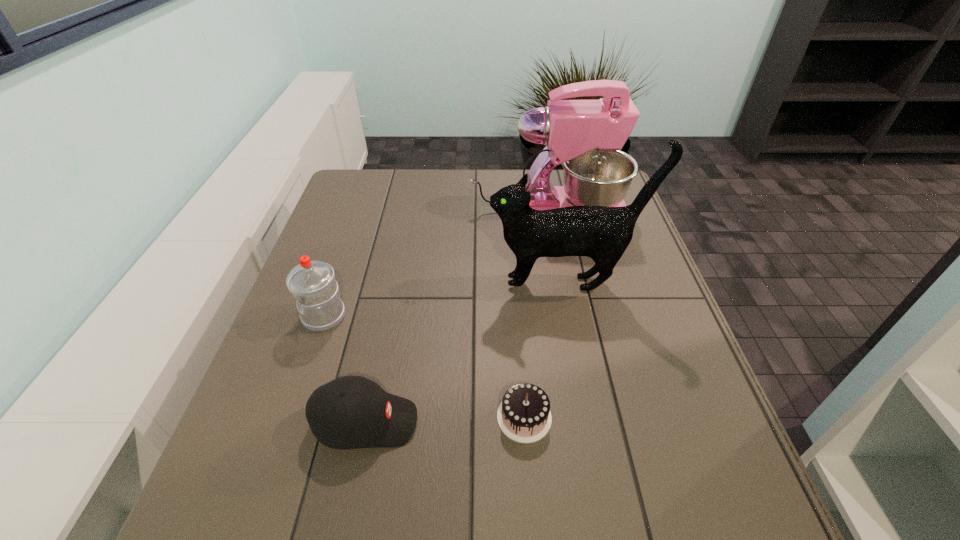
At what (x,y) coordinates should I click in order to perform the action: click on blank space at the far left corner of the desktop. Please return your answer as a coordinate pair (x, y). Looking at the image, I should click on (348, 194).

This screenshot has width=960, height=540. Identify the location of free space at the near right corner of the desktop. (677, 510).

Locate an element on the screen. free space between the mixer and the baseball cap is located at coordinates point(457,317).

The width and height of the screenshot is (960, 540). Identify the location of free spot between the second shortest object and the cat. (465, 353).

In order to click on blank region between the water bottle and the chocolate cake in this screenshot , I will do `click(424, 367)`.

Where is `free point between the shortest object and the cat`? This screenshot has width=960, height=540. free point between the shortest object and the cat is located at coordinates (544, 350).

Find the location of a particular element. This screenshot has height=540, width=960. empty location between the second shortest object and the water bottle is located at coordinates (345, 369).

Identify the location of unoccupied area between the chocolate cake and the baseball cap. (444, 420).

Locate an element on the screen. free space between the fourth tallest object and the cat is located at coordinates (465, 353).

Where is `vacant area that lies between the cat and the second shortest object`? vacant area that lies between the cat and the second shortest object is located at coordinates (465, 353).